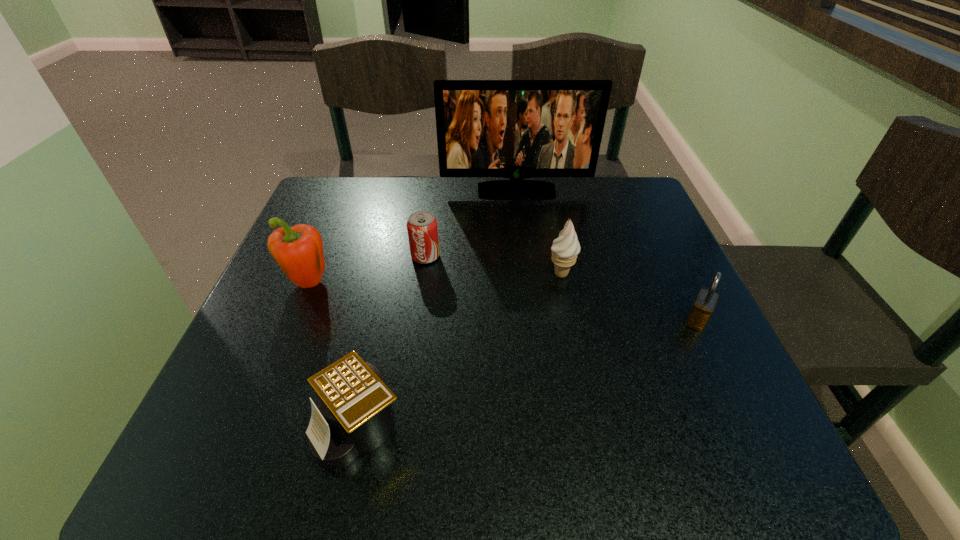
Locate an element on the screen. Image resolution: width=960 pixels, height=540 pixels. vacant space that satisfies the following two spatial constraints: 1. on the front-facing side of the icecream; 2. on the left side of the second nearest object is located at coordinates (570, 320).

Where is `vacant area in the image that satisfies the following two spatial constraints: 1. on the front-facing side of the fifth farthest object; 2. on the left side of the farthest object`? vacant area in the image that satisfies the following two spatial constraints: 1. on the front-facing side of the fifth farthest object; 2. on the left side of the farthest object is located at coordinates (531, 320).

Where is `free point that satisfies the following two spatial constraints: 1. on the front side of the leftmost object; 2. on the left side of the rightmost object`? Image resolution: width=960 pixels, height=540 pixels. free point that satisfies the following two spatial constraints: 1. on the front side of the leftmost object; 2. on the left side of the rightmost object is located at coordinates (293, 320).

Where is `vacant area in the image that satisfies the following two spatial constraints: 1. on the front-facing side of the third tallest object; 2. on the left side of the rightmost object`? vacant area in the image that satisfies the following two spatial constraints: 1. on the front-facing side of the third tallest object; 2. on the left side of the rightmost object is located at coordinates (570, 320).

This screenshot has height=540, width=960. What are the coordinates of `vacant region that satisfies the following two spatial constraints: 1. on the front-facing side of the icecream; 2. on the left side of the rightmost object` in the screenshot? It's located at (570, 320).

The image size is (960, 540). Identify the location of free location that satisfies the following two spatial constraints: 1. on the front-facing side of the second nearest object; 2. on the left side of the monitor. (531, 320).

Identify the location of vacant space that satisfies the following two spatial constraints: 1. on the back side of the soda can; 2. on the right side of the leftmost object. (320, 256).

You are a GUI agent. You are given a task and a screenshot of the screen. Output one action in this format:
    pyautogui.click(x=<x>, y=<y>)
    Task: Click on the free region that satisfies the following two spatial constraints: 1. on the back side of the padlock; 2. on the front-facing side of the icecream
    Image resolution: width=960 pixels, height=540 pixels.
    Given the screenshot: What is the action you would take?
    pyautogui.click(x=675, y=274)

At what (x,y) coordinates should I click in order to perform the action: click on free point that satisfies the following two spatial constraints: 1. on the front-facing side of the icecream; 2. on the right side of the padlock. Please return your answer as a coordinate pair (x, y). The width and height of the screenshot is (960, 540). Looking at the image, I should click on (570, 320).